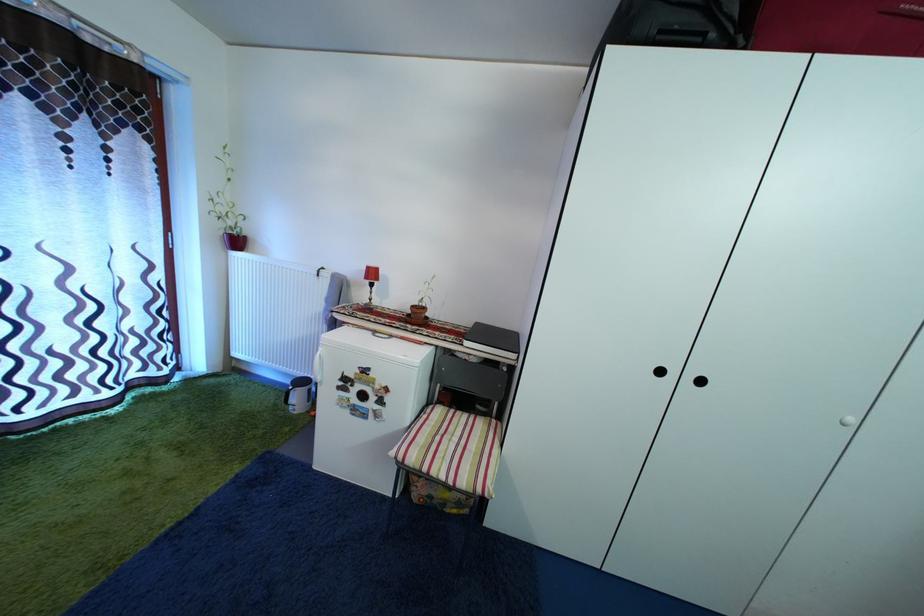
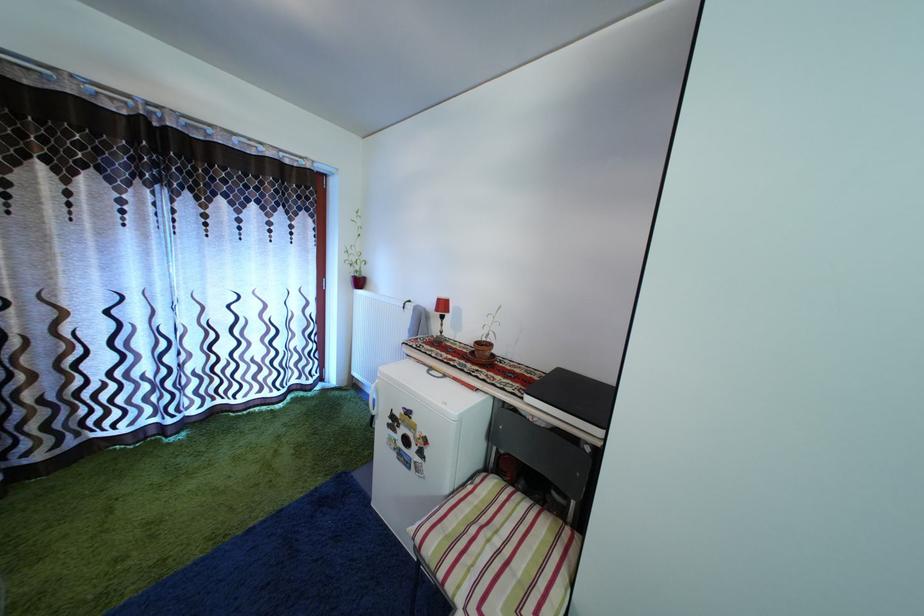
The point at [377,276] is marked in the first image. Where is the corresponding point in the second image?

(446, 308)